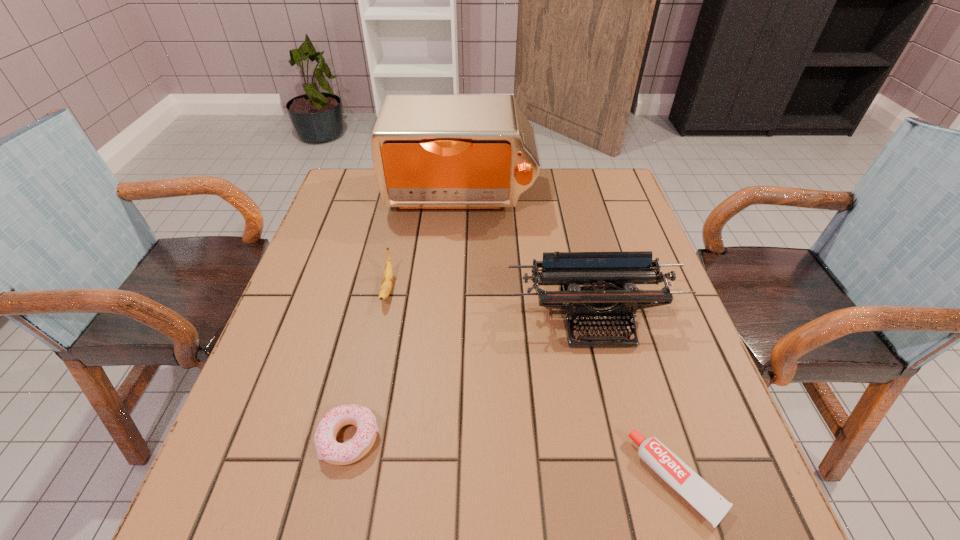
Find the location of a particular element. vacant space at the right edge of the desktop is located at coordinates (621, 373).

Where is `vacant region at the near left corner of the desktop`? This screenshot has width=960, height=540. vacant region at the near left corner of the desktop is located at coordinates (281, 516).

The width and height of the screenshot is (960, 540). In the image, there is a desktop. Find the location of `free space at the far right corner`. free space at the far right corner is located at coordinates (593, 176).

At what (x,y) coordinates should I click in order to perform the action: click on free space that is in between the fourth shortest object and the farthest object. Please return your answer as a coordinate pair (x, y). The height and width of the screenshot is (540, 960). Looking at the image, I should click on (527, 258).

Find the location of `free space between the third tallest object and the toothpaste`. free space between the third tallest object and the toothpaste is located at coordinates (532, 384).

Image resolution: width=960 pixels, height=540 pixels. In order to click on empty space that is in between the third shortest object and the shortest object in this screenshot , I will do `click(532, 384)`.

Image resolution: width=960 pixels, height=540 pixels. Identify the location of empty space between the banana and the fourth shortest object. (492, 304).

Locate an element on the screen. The width and height of the screenshot is (960, 540). empty space that is in between the toothpaste and the doughnut is located at coordinates tap(514, 460).

At what (x,y) coordinates should I click in order to perform the action: click on free spot between the doughnut and the typewriter. Please return your answer as a coordinate pair (x, y). Looking at the image, I should click on (472, 379).

This screenshot has width=960, height=540. I want to click on free area in between the second shortest object and the toothpaste, so click(514, 460).